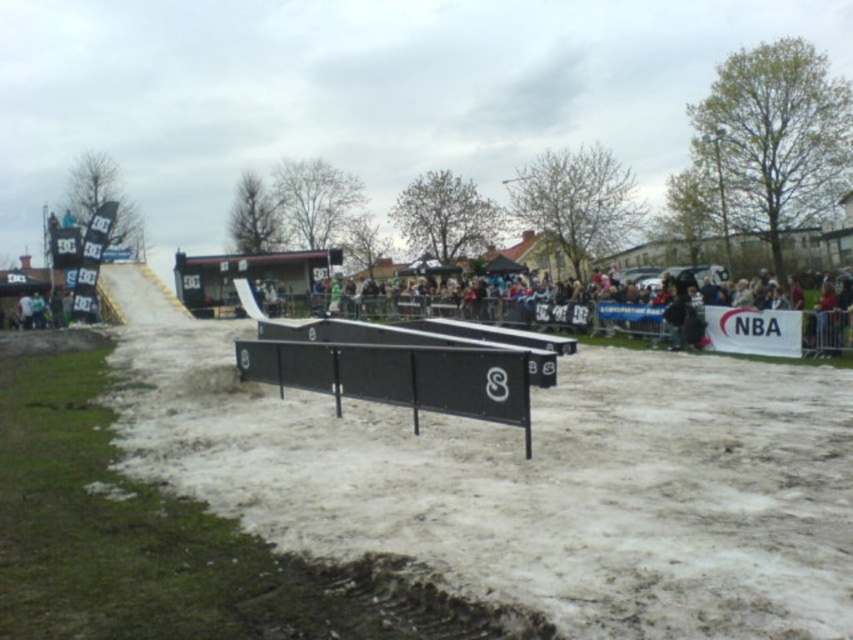
Question: Is brown dirt track at lower left thinner than black matte ramp at center?

Choices:
 (A) no
 (B) yes

Answer: (B)

Question: Is brown dirt track at lower left bigger than black matte ramp at center?

Choices:
 (A) yes
 (B) no

Answer: (B)

Question: Among these objects, which one is farthest from the camera?

Choices:
 (A) brown dirt track at lower left
 (B) black matte ramp at center

Answer: (B)

Question: Which point is closer to the camera?

Choices:
 (A) brown dirt track at lower left
 (B) black matte ramp at center

Answer: (A)

Question: Among these objects, which one is nearest to the camera?

Choices:
 (A) brown dirt track at lower left
 (B) black matte ramp at center

Answer: (A)

Question: Can you confirm if brown dirt track at lower left is positioned above black matte ramp at center?

Choices:
 (A) yes
 (B) no

Answer: (B)